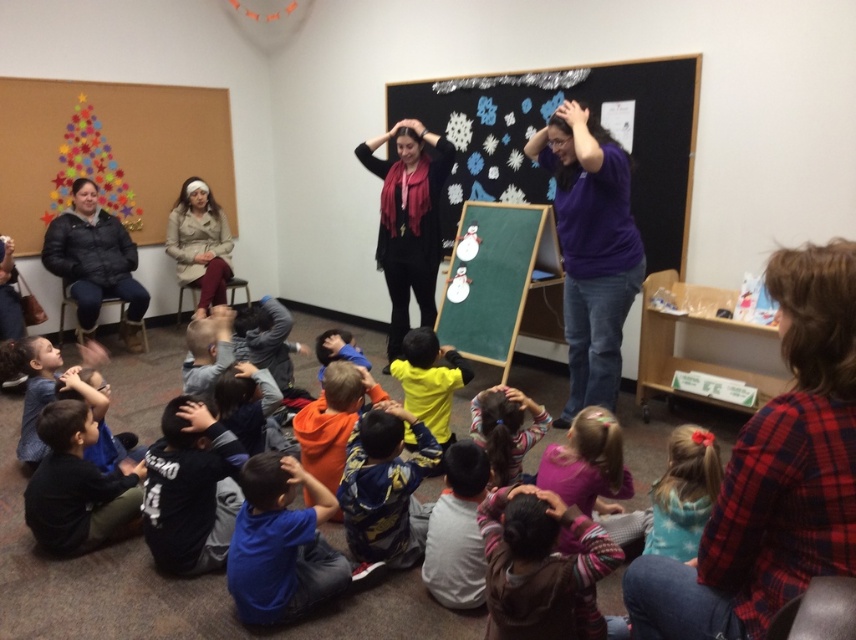
Can you confirm if matte black chalkboard at center is thinner than striped sweater at center?

In fact, matte black chalkboard at center might be wider than striped sweater at center.

Who is positioned more to the left, matte black chalkboard at center or striped sweater at center?

From the viewer's perspective, striped sweater at center appears more on the left side.

Which is behind, point (563, 92) or point (536, 528)?

Positioned behind is point (563, 92).

The height and width of the screenshot is (640, 856). In order to click on matte black chalkboard at center in this screenshot , I will do `click(545, 122)`.

Is matte black chalkboard at center bigger than black cotton shirt at lower left?

Correct, matte black chalkboard at center is larger in size than black cotton shirt at lower left.

Does matte black chalkboard at center have a smaller size compared to black cotton shirt at lower left?

Incorrect, matte black chalkboard at center is not smaller in size than black cotton shirt at lower left.

Is point (479, 106) closer to viewer compared to point (81, 552)?

No, (479, 106) is behind (81, 552).

Where is `matte black chalkboard at center`? The width and height of the screenshot is (856, 640). matte black chalkboard at center is located at coordinates (545, 122).

Is the position of black matte scarf at center less distant than that of black puffy jacket at left?

Yes, black matte scarf at center is closer to the viewer.

Does black matte scarf at center appear on the left side of black puffy jacket at left?

Incorrect, black matte scarf at center is not on the left side of black puffy jacket at left.

The image size is (856, 640). What are the coordinates of `black matte scarf at center` in the screenshot? It's located at (408, 220).